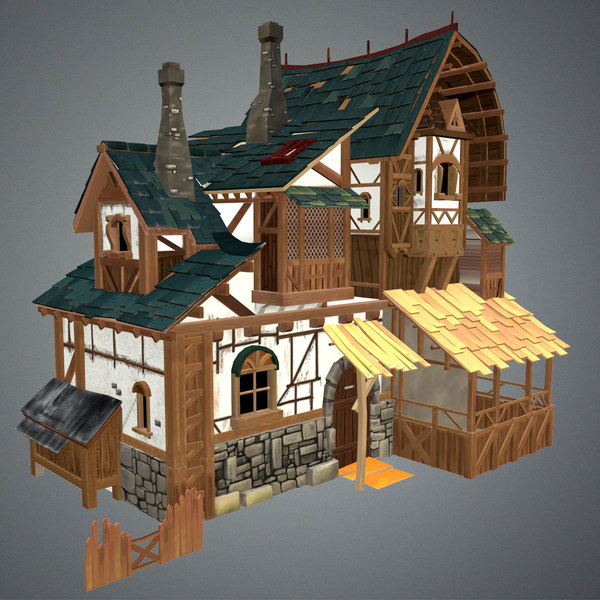
Find the location of `chimney`. chimney is located at coordinates (184, 169), (269, 86).